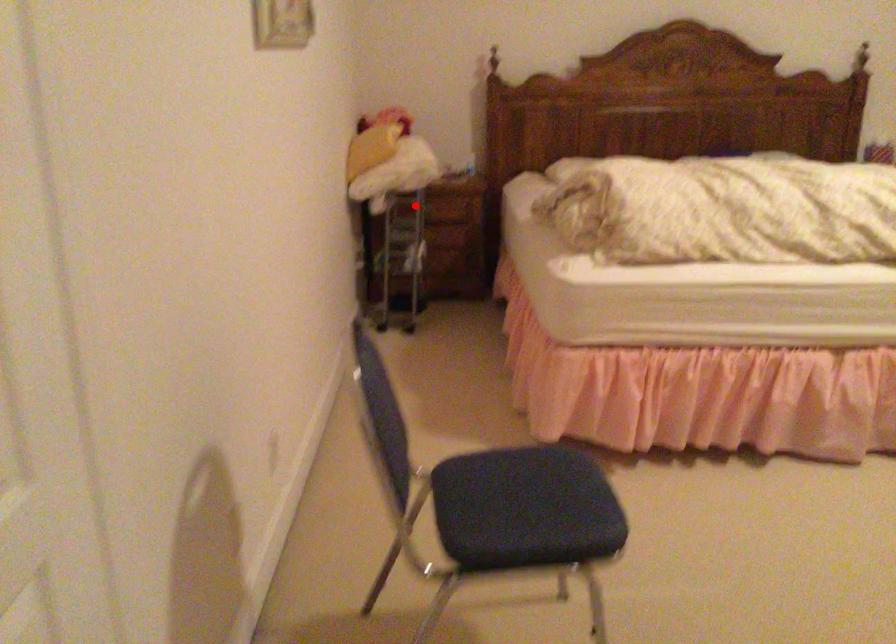
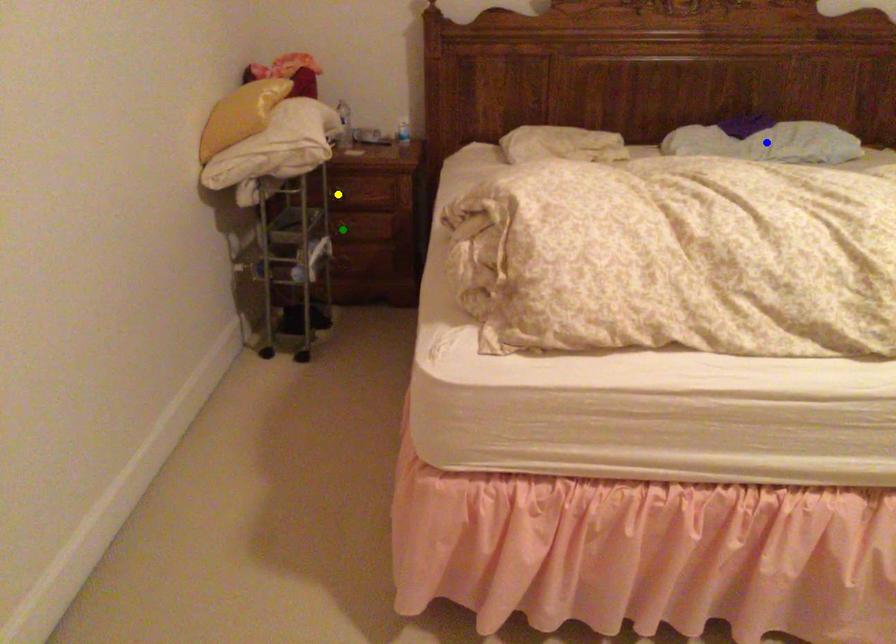
Question: I am providing you with two images of the same scene from different viewpoints. A red point is marked on the first image. You are given multiple points on the second image. In image 2, which mark is for the same physical point as the one in image 1?

Choices:
 (A) blue point
 (B) green point
 (C) yellow point

Answer: (C)